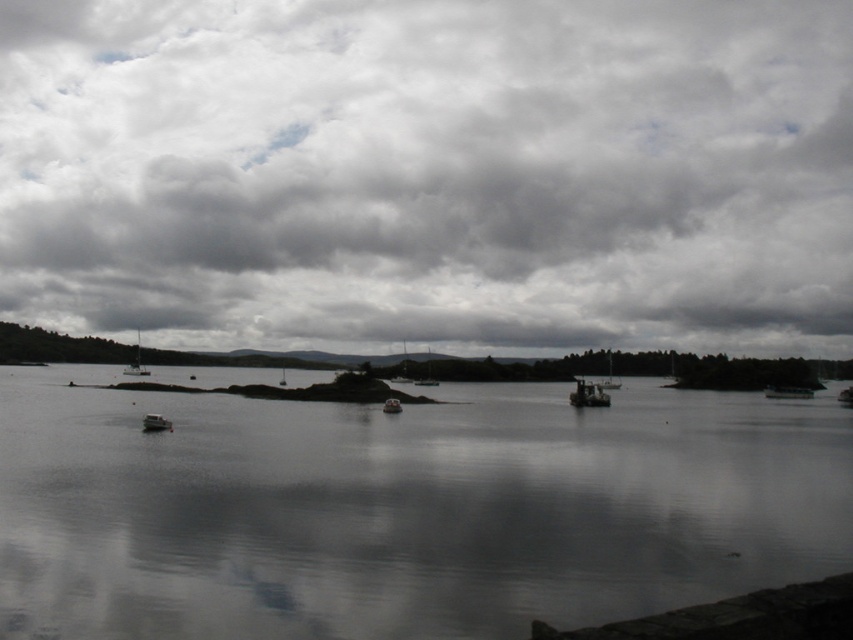
Which is above, metallic silver boat at lower left or metallic gray boat at center?

metallic silver boat at lower left is higher up.

Does metallic silver boat at lower left have a greater width compared to metallic gray boat at center?

Indeed, metallic silver boat at lower left has a greater width compared to metallic gray boat at center.

Locate an element on the screen. The image size is (853, 640). metallic silver boat at lower left is located at coordinates (155, 422).

Can you confirm if metallic silver boat at center is positioned below metallic gray boat at lower right?

No.

Is point (589, 394) farther from viewer compared to point (805, 392)?

No, (589, 394) is closer to viewer.

Find the location of a particular element. The image size is (853, 640). metallic silver boat at center is located at coordinates (589, 394).

Can you confirm if metallic gray boat at lower right is wider than metallic silver boat at lower left?

Indeed, metallic gray boat at lower right has a greater width compared to metallic silver boat at lower left.

Is metallic gray boat at lower right below metallic silver boat at lower left?

Indeed, metallic gray boat at lower right is positioned under metallic silver boat at lower left.

Does point (796, 397) lie behind point (171, 424)?

Yes.

The image size is (853, 640). I want to click on metallic gray boat at lower right, so click(x=787, y=392).